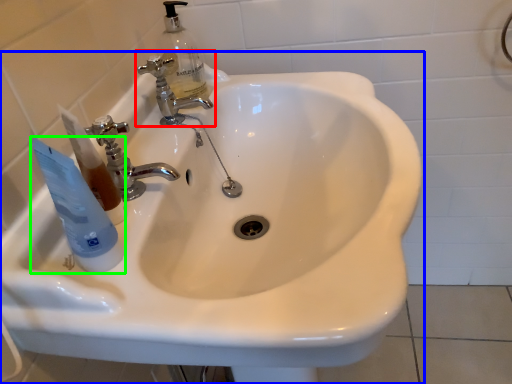
Question: Based on their relative distances, which object is farther from tap (highlighted by a red box)? Choose from sink (highlighted by a blue box) and mouthwash (highlighted by a green box).

Choices:
 (A) sink
 (B) mouthwash

Answer: (B)